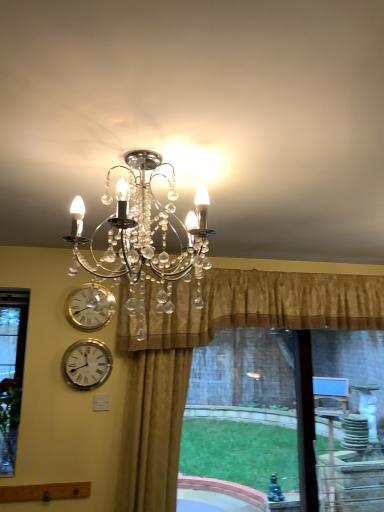
Question: From the image's perspective, relative to clear crystal chandelier at upper center, is silver metallic wall clock at lower left, the 1th wall clock from the bottom, above or below?

Choices:
 (A) above
 (B) below

Answer: (B)

Question: Does point (74, 344) appear closer or farther from the camera than point (77, 258)?

Choices:
 (A) farther
 (B) closer

Answer: (A)

Question: Estimate the real-world distances between objects in this image. Which object is closer to the silver metallic wall clock at lower left, marked as the second wall clock in a top-to-bottom arrangement?

Choices:
 (A) silver metallic wall clock at left, positioned as the 1th wall clock in top-to-bottom order
 (B) clear crystal chandelier at upper center
 (C) gold textured curtain at upper center, marked as the 2th curtain in a left-to-right arrangement
 (D) gold velvet curtain at center, which appears as the 2th curtain when viewed from the right

Answer: (A)

Question: Estimate the real-world distances between objects in this image. Which object is farther from the gold textured curtain at upper center, marked as the 2th curtain in a left-to-right arrangement?

Choices:
 (A) silver metallic wall clock at lower left, marked as the second wall clock in a top-to-bottom arrangement
 (B) silver metallic wall clock at left, positioned as the 1th wall clock in top-to-bottom order
 (C) clear crystal chandelier at upper center
 (D) gold velvet curtain at center, which appears as the 2th curtain when viewed from the right

Answer: (C)